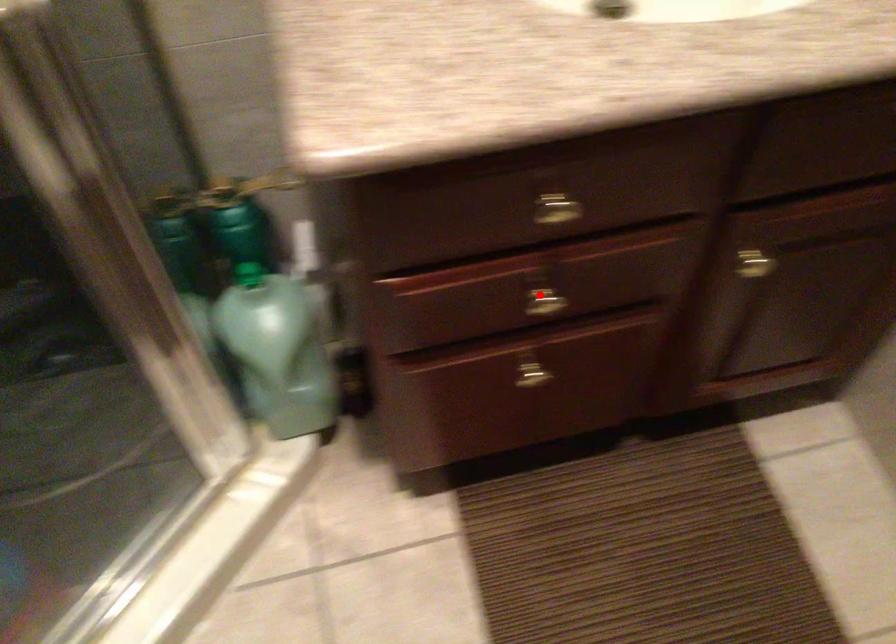
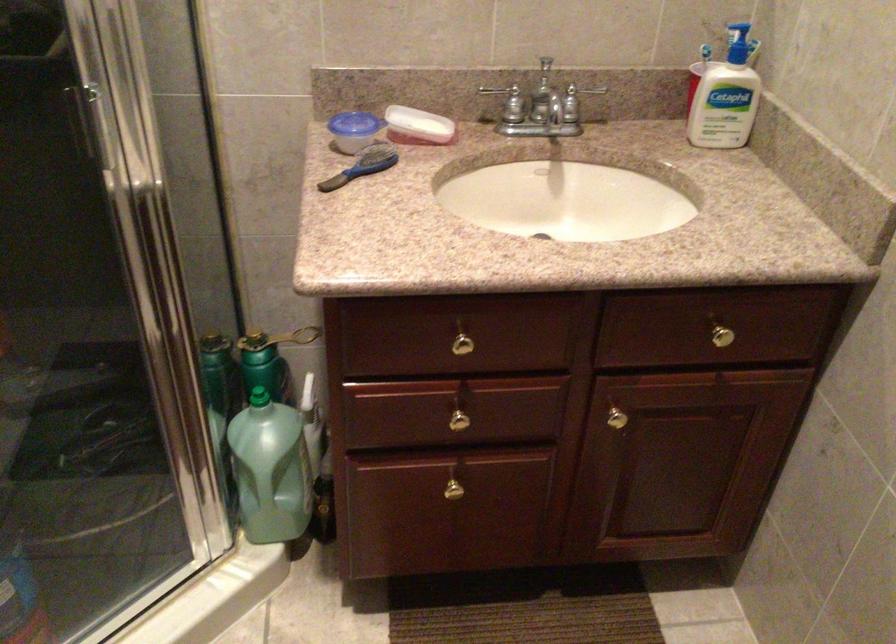
Question: I am providing you with two images of the same scene from different viewpoints. In image1, a red point is highlighted. Considering the same 3D point in image2, which of the following is correct?

Choices:
 (A) It is closer
 (B) It is farther

Answer: (B)